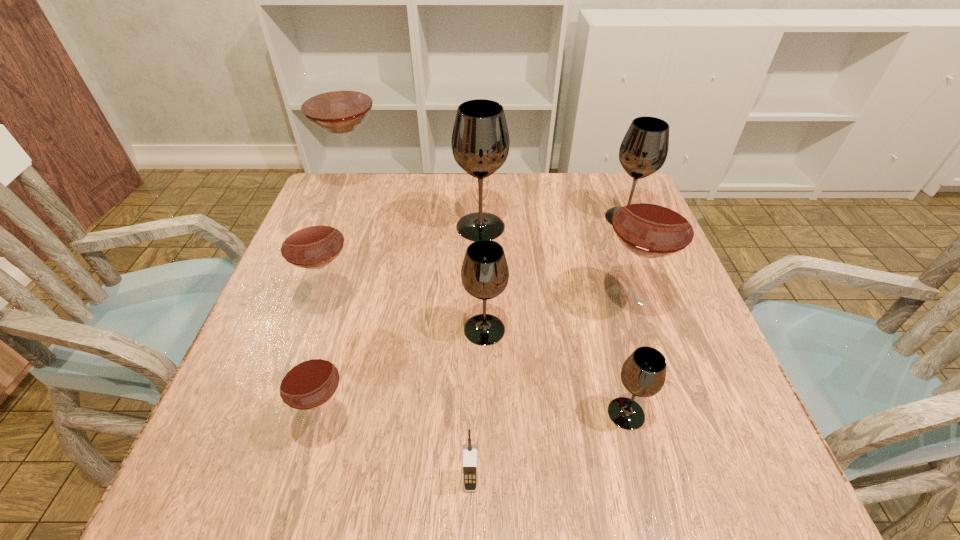
At what (x,y) coordinates should I click in order to perform the action: click on the farthest red wineglass. Please return your answer as a coordinate pair (x, y). Looking at the image, I should click on (336, 99).

This screenshot has height=540, width=960. I want to click on the biggest gray wineglass, so click(x=480, y=140).

At what (x,y) coordinates should I click in order to perform the action: click on the third smallest gray wineglass. Please return your answer as a coordinate pair (x, y). Looking at the image, I should click on (644, 148).

Identify the location of the second biggest red wineglass. (654, 219).

Locate an element on the screen. the third biggest red wineglass is located at coordinates [x=311, y=239].

Where is `the second smallest gray wineglass`? The height and width of the screenshot is (540, 960). the second smallest gray wineglass is located at coordinates (484, 273).

What are the coordinates of `the smallest red wineglass` in the screenshot? It's located at tap(306, 379).

Locate an element on the screen. the nearest gray wineglass is located at coordinates (643, 373).

Identify the location of the third gray wineglass from left to right. (643, 373).

Identify the location of the nearest object. (469, 464).